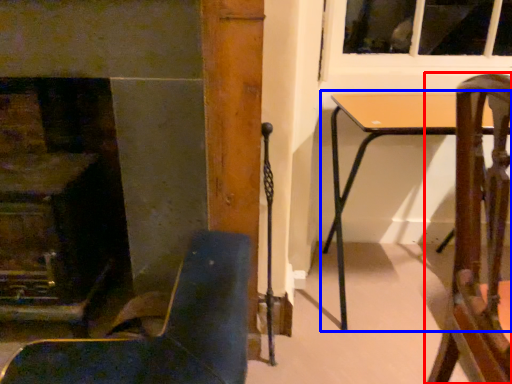
Question: Which point is further to the camera, chair (highlighted by a red box) or table (highlighted by a blue box)?

Choices:
 (A) chair
 (B) table

Answer: (B)